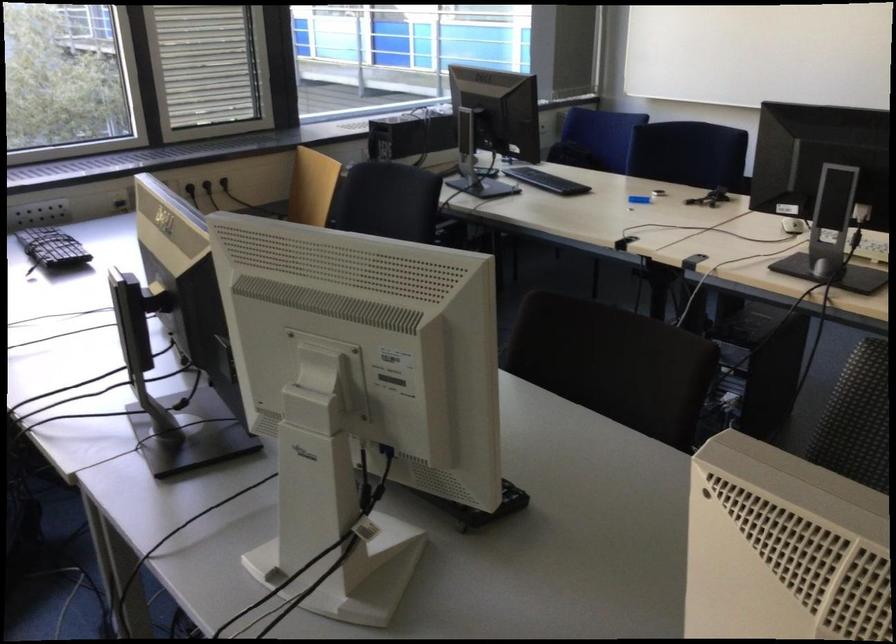
Find where to sit the blue chair sitting surface. Please return your answer as a coordinate pair (x, y).

(596, 138)